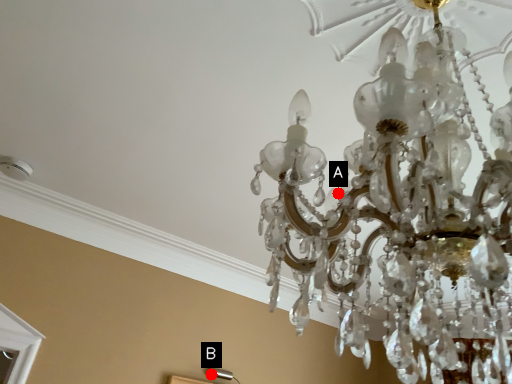
Question: Two points are circled on the image, labeled by A and B beside each circle. Which of the following is the closest to the observer?

Choices:
 (A) A is closer
 (B) B is closer

Answer: (A)